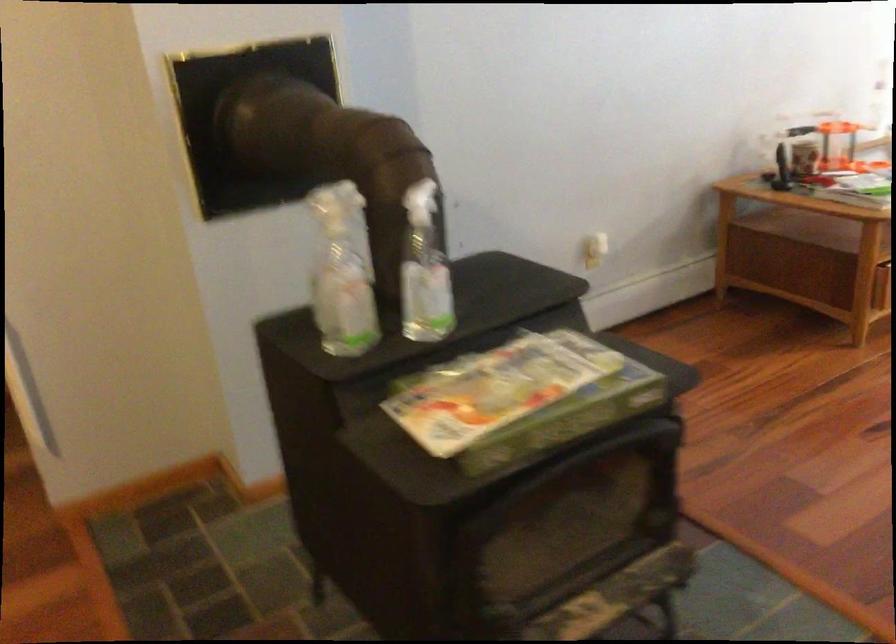
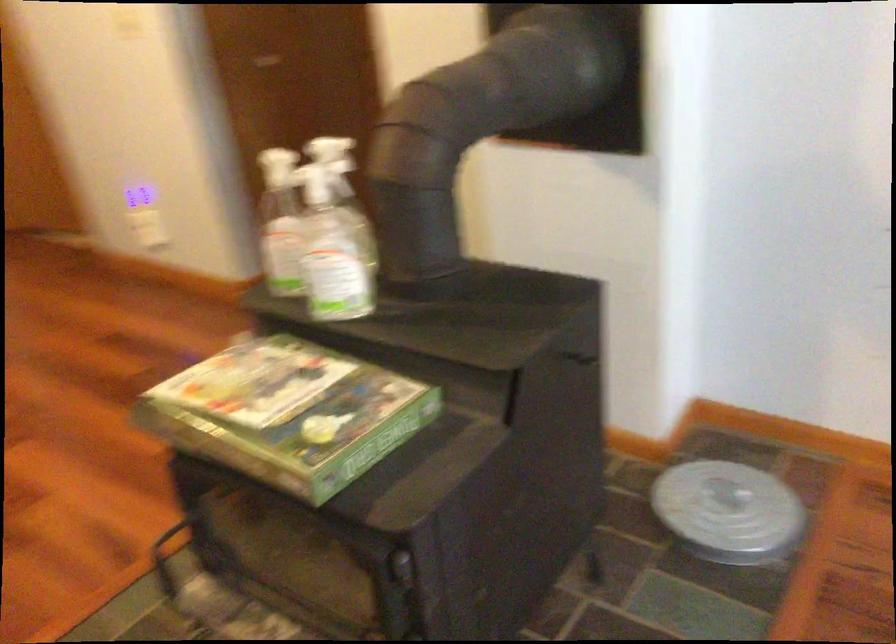
In the second image, find the point that corresponds to (569,377) in the first image.

(289, 413)